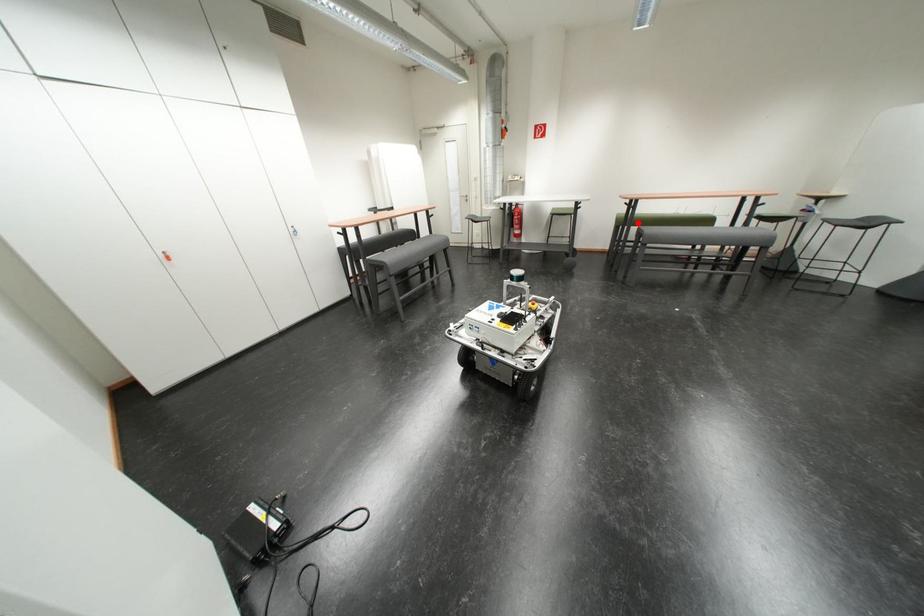
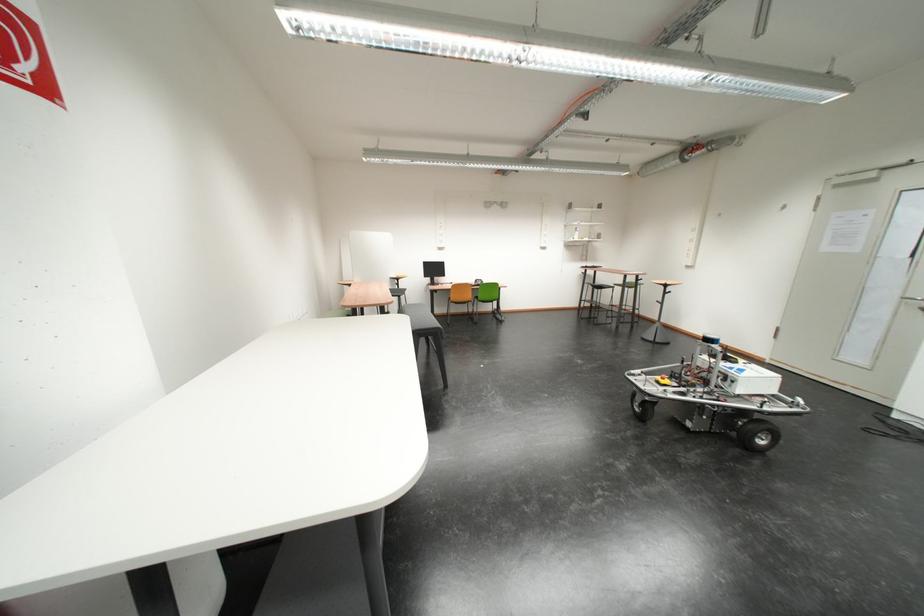
Question: I am providing you with two images of the same scene from different viewpoints. A red point is marked on the first image. Is the red point's position out of view in image 2?

Choices:
 (A) Yes
 (B) No

Answer: (A)